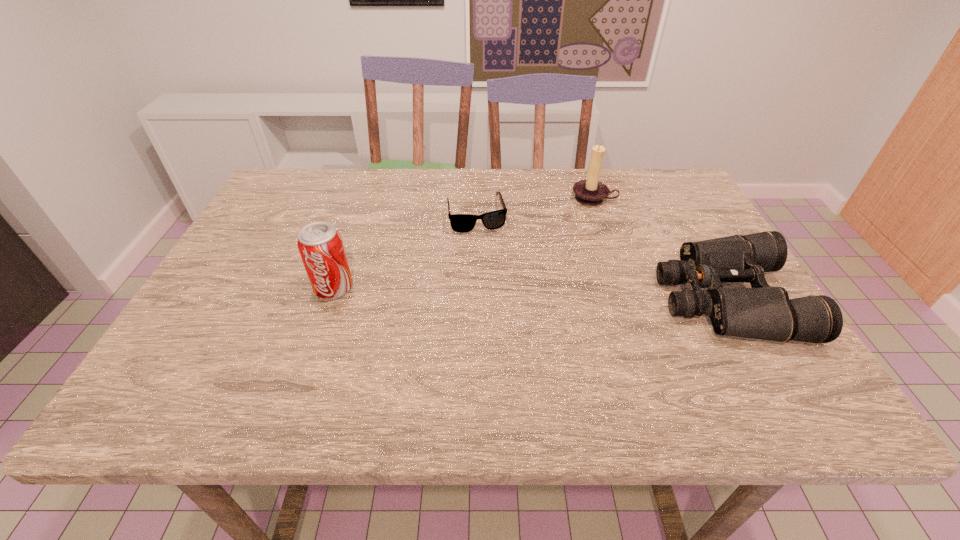
Where is `vacant space located on the wick of the candle holder`? The height and width of the screenshot is (540, 960). vacant space located on the wick of the candle holder is located at coordinates (561, 285).

The image size is (960, 540). I want to click on vacant position located 0.330m on the wick of the candle holder, so click(561, 285).

At what (x,y) coordinates should I click in order to perform the action: click on vacant space located 0.380m on the wick of the candle holder. Please return your answer as a coordinate pair (x, y). The height and width of the screenshot is (540, 960). Looking at the image, I should click on (555, 300).

Identify the location of free space located on the front-facing side of the shortest object. (512, 336).

You are a GUI agent. You are given a task and a screenshot of the screen. Output one action in this format:
    pyautogui.click(x=<x>, y=<y>)
    Task: Click on the vacant region located on the front-facing side of the shortest object
    
    Given the screenshot: What is the action you would take?
    pyautogui.click(x=495, y=282)

You are a GUI agent. You are given a task and a screenshot of the screen. Output one action in this format:
    pyautogui.click(x=<x>, y=<y>)
    Task: Click on the vacant space situated on the front-facing side of the shortest object
    The height and width of the screenshot is (540, 960).
    Given the screenshot: What is the action you would take?
    pyautogui.click(x=489, y=260)

The image size is (960, 540). Identify the location of candle holder present at the far edge. (590, 192).

The image size is (960, 540). I want to click on sunglasses at the far edge, so 462,223.

In order to click on object located in the near edge section of the desktop in this screenshot , I will do `click(765, 312)`.

You are a GUI agent. You are given a task and a screenshot of the screen. Output one action in this format:
    pyautogui.click(x=<x>, y=<y>)
    Task: Click on the object that is positioned at the right edge
    The width and height of the screenshot is (960, 540).
    Given the screenshot: What is the action you would take?
    pyautogui.click(x=765, y=312)